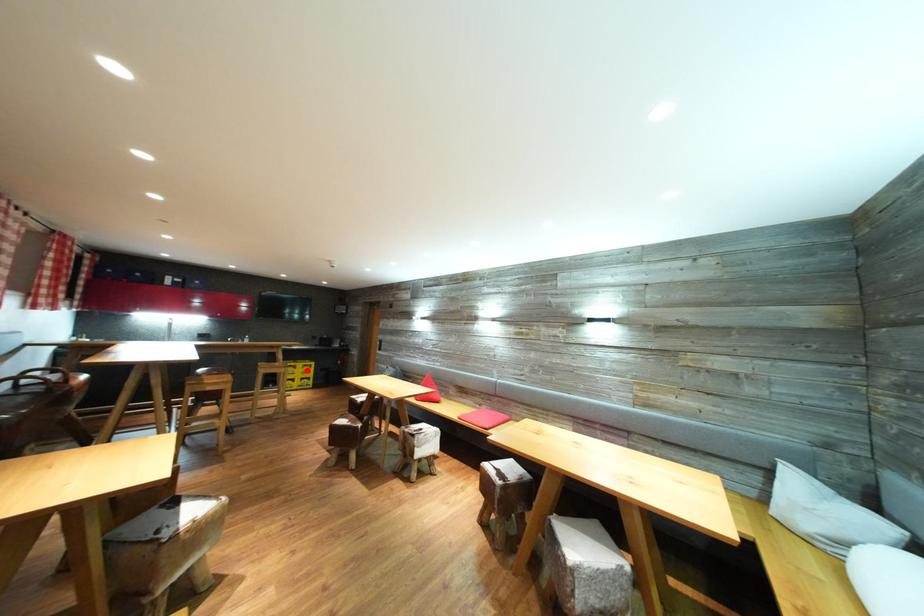
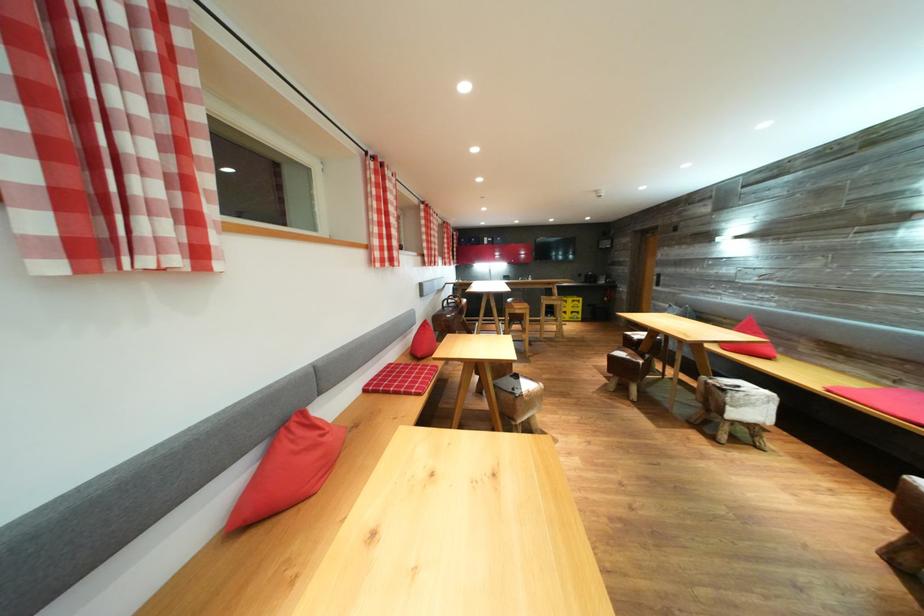
In the second image, find the point that corresponds to the highlighted location in the first image.

(577, 305)